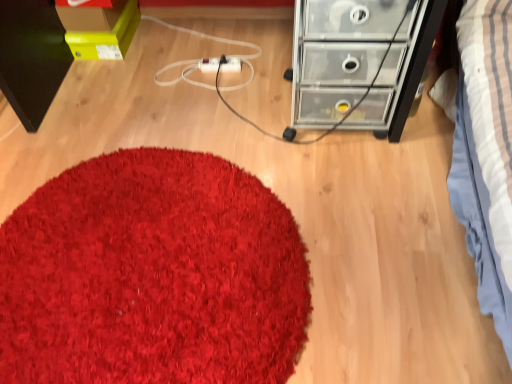
Find the location of a particular element. Image resolution: width=512 pixels, height=384 pixels. free space between transparent plastic chest of drawers at upper right and shaggy red carpet at center is located at coordinates (251, 157).